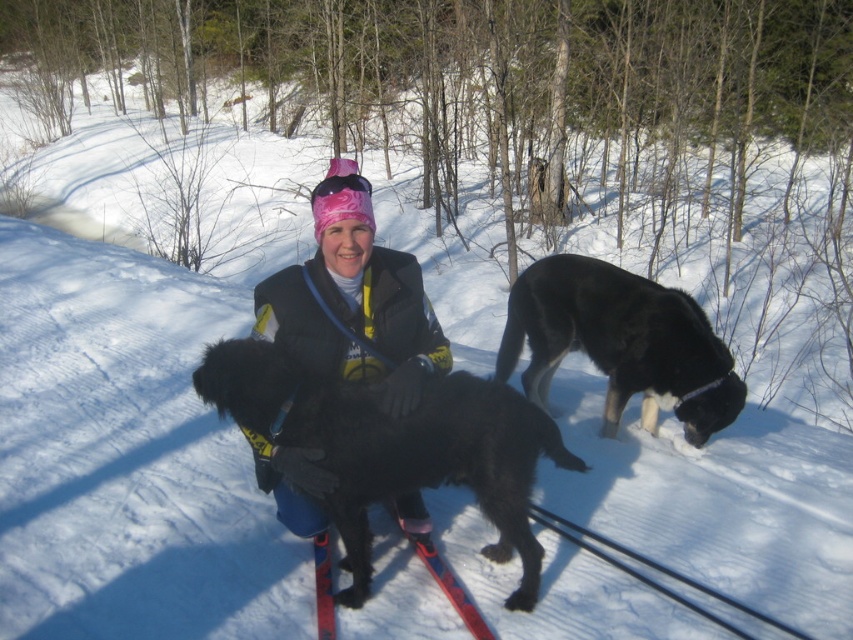
Does black fuzzy dog at center have a greater height compared to black fur dog at right?

No.

Looking at this image, measure the distance between point [518,404] and camera.

10.03 feet

Image resolution: width=853 pixels, height=640 pixels. Find the location of `black fuzzy dog at center`. black fuzzy dog at center is located at coordinates (396, 445).

Does black fur dog at right appear over red plastic ski at center?

Yes.

Between black fur dog at right and red plastic ski at center, which one is positioned higher?

black fur dog at right is higher up.

The width and height of the screenshot is (853, 640). I want to click on black fur dog at right, so click(x=619, y=342).

Does matte black jacket at center have a greater height compared to red plastic ski at center?

Yes, matte black jacket at center is taller than red plastic ski at center.

Which of these two, matte black jacket at center or red plastic ski at center, stands taller?

With more height is matte black jacket at center.

Who is more distant from viewer, (x=299, y=451) or (x=326, y=586)?

Positioned behind is point (x=326, y=586).

Where is `matte black jacket at center`? matte black jacket at center is located at coordinates (354, 300).